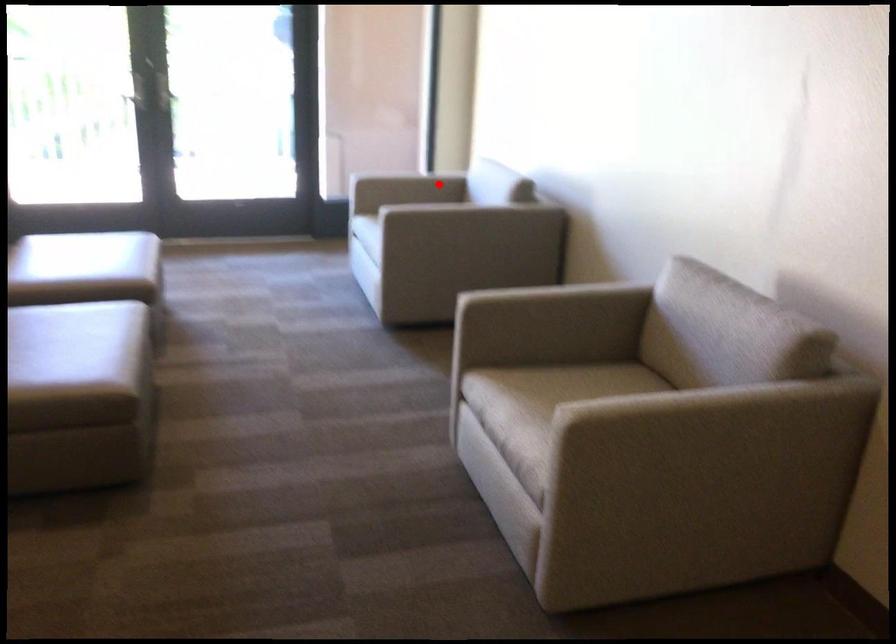
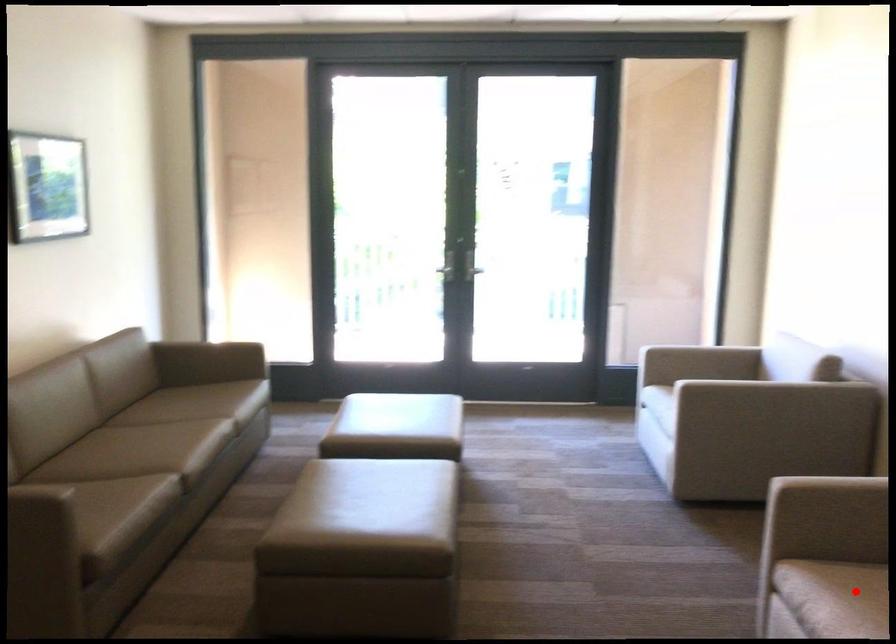
I am providing you with two images of the same scene from different viewpoints. A red point is marked on the first image and another point is marked on the second image. Is the marked point in image1 the same physical position as the marked point in image2?

No